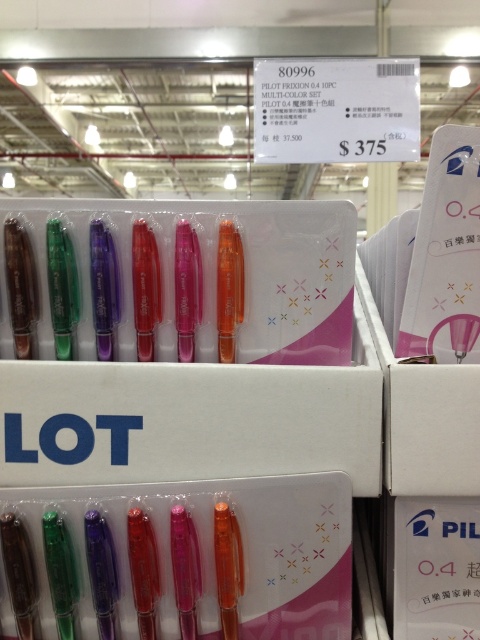
Question: Which of the following is the farthest from the observer?

Choices:
 (A) (166, 483)
 (B) (323, 468)

Answer: (A)

Question: Can you confirm if translucent plastic pens at center is wider than translucent plastic pens at lower center?

Choices:
 (A) no
 (B) yes

Answer: (B)

Question: Which of the following is the farthest from the observer?

Choices:
 (A) (84, 355)
 (B) (166, 604)

Answer: (A)

Question: Can you confirm if translucent plastic pens at center is wider than translucent plastic pens at lower center?

Choices:
 (A) yes
 (B) no

Answer: (A)

Question: Does translucent plastic pens at center appear on the right side of translucent plastic pens at lower center?

Choices:
 (A) yes
 (B) no

Answer: (A)